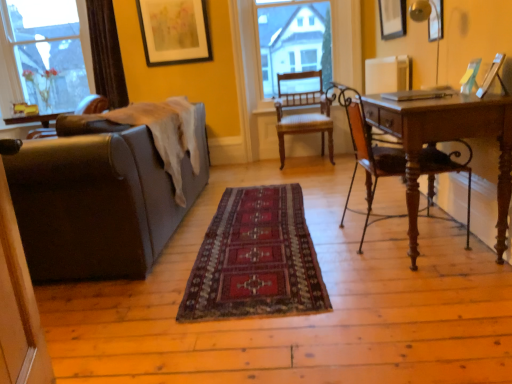
The width and height of the screenshot is (512, 384). What do you see at coordinates (98, 199) in the screenshot?
I see `brown leather couch at left` at bounding box center [98, 199].

Describe the element at coordinates (294, 42) in the screenshot. I see `transparent glass chair at upper center` at that location.

Identify the location of clear glass window at upper left. (116, 57).

This screenshot has width=512, height=384. In order to click on brown wooden chair at right, which is the second chair in back-to-front order in this screenshot , I will do `click(369, 158)`.

Is clear glass window at upper left far from brown wooden chair at right, which is the second chair in back-to-front order?

clear glass window at upper left is positioned a significant distance from brown wooden chair at right, which is the second chair in back-to-front order.

Is clear glass window at upper left oriented away from brown wooden chair at right, the first chair positioned from the front?

No.

From the image's perspective, which chair is the 2nd one below the clear glass window at upper left? Please provide its 2D coordinates.

[(369, 158)]

Choose the correct answer: Is clear glass window at upper left inside brown wooden chair at right, the first chair positioned from the front, or outside it?

clear glass window at upper left is located beyond the bounds of brown wooden chair at right, the first chair positioned from the front.

Can you tell me how much transparent glass chair at upper center and clear glass window at upper left differ in facing direction?

The angle between the facing direction of transparent glass chair at upper center and the facing direction of clear glass window at upper left is 1.97 degrees.

Which of these two, transparent glass chair at upper center or clear glass window at upper left, is thinner?

transparent glass chair at upper center.

Between transparent glass chair at upper center and clear glass window at upper left, which one appears on the right side from the viewer's perspective?

From the viewer's perspective, transparent glass chair at upper center appears more on the right side.

Choose the correct answer: Is transparent glass chair at upper center inside clear glass window at upper left or outside it?

transparent glass chair at upper center exists outside the volume of clear glass window at upper left.

From a real-world perspective, is brown leather couch at left beneath brown wooden chair at right, the first chair positioned from the front?

Yes, from a real-world perspective, brown leather couch at left is below brown wooden chair at right, the first chair positioned from the front.

Consider the image. Between brown leather couch at left and brown wooden chair at right, the first chair positioned from the front, which one has more height?

brown wooden chair at right, the first chair positioned from the front.

Is brown leather couch at left oriented away from brown wooden chair at right, which is the second chair in back-to-front order?

Yes, brown leather couch at left's orientation is away from brown wooden chair at right, which is the second chair in back-to-front order.

The image size is (512, 384). I want to click on bay window that is behind the matte black picture frame at upper center, acting as the 1th picture frame starting from the left, so click(294, 42).

Based on the photo, is transparent glass chair at upper center wider than matte black picture frame at upper center, which appears as the 3th picture frame when viewed from the right?

Indeed, transparent glass chair at upper center has a greater width compared to matte black picture frame at upper center, which appears as the 3th picture frame when viewed from the right.

Can you confirm if transparent glass chair at upper center is positioned to the left of matte black picture frame at upper center, acting as the 1th picture frame starting from the left?

No, transparent glass chair at upper center is not to the left of matte black picture frame at upper center, acting as the 1th picture frame starting from the left.

Is wooden picture frame at upper right, the third picture frame positioned from the left, inside wooden chair at center, the 1th chair when ordered from back to front?

No, wooden chair at center, the 1th chair when ordered from back to front, does not contain wooden picture frame at upper right, the third picture frame positioned from the left.

From a real-world perspective, does wooden chair at center, placed as the second chair when sorted from front to back, stand above wooden picture frame at upper right, the 2th picture frame when ordered from back to front?

Incorrect, from a real-world perspective, wooden chair at center, placed as the second chair when sorted from front to back, is lower than wooden picture frame at upper right, the 2th picture frame when ordered from back to front.

From the wooden chair at center, the 1th chair when ordered from back to front, count 2nd picture frame to the right and point to it. Please provide its 2D coordinates.

[(392, 18)]

Are wooden chair at center, the 1th chair when ordered from back to front, and wooden picture frame at upper right, placed as the 2th picture frame when sorted from front to back, far apart?

That's right, there is a large distance between wooden chair at center, the 1th chair when ordered from back to front, and wooden picture frame at upper right, placed as the 2th picture frame when sorted from front to back.

Is transparent glass chair at upper center not within wooden chair at center, the 1th chair when ordered from back to front?

That's correct, transparent glass chair at upper center is outside of wooden chair at center, the 1th chair when ordered from back to front.

What's the angular difference between transparent glass chair at upper center and wooden chair at center, placed as the second chair when sorted from front to back,'s facing directions?

2.87 degrees.

Is transparent glass chair at upper center turned away from wooden chair at center, the 1th chair when ordered from back to front?

No, transparent glass chair at upper center is not facing the opposite direction of wooden chair at center, the 1th chair when ordered from back to front.

Consider the image. Between silver metallic laptop at right and clear glass window at upper left, which one has smaller width?

With smaller width is silver metallic laptop at right.

Is clear glass window at upper left at the back of silver metallic laptop at right?

silver metallic laptop at right is not turned away from clear glass window at upper left.

Is silver metallic laptop at right positioned far away from clear glass window at upper left?

That's right, there is a large distance between silver metallic laptop at right and clear glass window at upper left.

The image size is (512, 384). In order to click on window above the brown wooden chair at right, the first chair positioned from the front (from a real-world perspective) in this screenshot , I will do `click(116, 57)`.

Image resolution: width=512 pixels, height=384 pixels. Find the location of `bay window that is below the clear glass window at upper left (from the image's perspective)`. bay window that is below the clear glass window at upper left (from the image's perspective) is located at coordinates [294, 42].

Looking at the image, which one is located closer to transparent glass chair at upper center, wooden picture frame at upper right, the third picture frame positioned from the left, or matte black picture frame at upper center, acting as the 1th picture frame starting from the left?

matte black picture frame at upper center, acting as the 1th picture frame starting from the left, lies closer to transparent glass chair at upper center than the other object.

From the picture: Which object lies nearer to the anchor point wooden chair at center, the 1th chair when ordered from back to front, brown leather couch at left or white matte radiator at upper right?

white matte radiator at upper right lies closer to wooden chair at center, the 1th chair when ordered from back to front, than the other object.

Estimate the real-world distances between objects in this image. Which object is further from clear glass window at upper left, silver metallic laptop at right or wooden picture frame at upper right, placed as the 2th picture frame when sorted from front to back?

The object further to clear glass window at upper left is silver metallic laptop at right.

When comparing their distances from matte black picture frame at upper center, the third picture frame when ordered from front to back, does brown leather couch at left or silver metallic laptop at right seem further?

silver metallic laptop at right lies further to matte black picture frame at upper center, the third picture frame when ordered from front to back, than the other object.

Based on their spatial positions, is clear glass window at upper left or transparent glass chair at upper center further from white matte radiator at upper right?

Based on the image, clear glass window at upper left appears to be further to white matte radiator at upper right.

Considering their positions, is silver metallic laptop at right positioned further to metallic gold picture frame at upper right, the third picture frame from the back, than brown wooden chair at right, the first chair positioned from the front?

Based on the image, brown wooden chair at right, the first chair positioned from the front, appears to be further to metallic gold picture frame at upper right, the third picture frame from the back.

Looking at the image, which one is located closer to wooden chair at center, placed as the second chair when sorted from front to back, transparent glass chair at upper center or white matte radiator at upper right?

transparent glass chair at upper center.

From the image, which object appears to be nearer to metallic gold picture frame at upper right, the third picture frame from the back, brown leather couch at left or wooden chair at center, the 1th chair when ordered from back to front?

wooden chair at center, the 1th chair when ordered from back to front.

The width and height of the screenshot is (512, 384). Identify the location of chair between metallic gold picture frame at upper right, the 2th picture frame positioned from the left, and transparent glass chair at upper center from front to back. (304, 113).

Where is `studio couch between brown wooden chair at right, the first chair positioned from the front, and wooden chair at center, placed as the second chair when sorted from front to back, in the front-back direction`? Image resolution: width=512 pixels, height=384 pixels. studio couch between brown wooden chair at right, the first chair positioned from the front, and wooden chair at center, placed as the second chair when sorted from front to back, in the front-back direction is located at coordinates (98, 199).

Image resolution: width=512 pixels, height=384 pixels. I want to click on chair positioned between brown leather couch at left and clear glass window at upper left from near to far, so click(x=304, y=113).

Locate an element on the screen. The height and width of the screenshot is (384, 512). picture frame between clear glass window at upper left and silver metallic laptop at right in the horizontal direction is located at coordinates (174, 31).